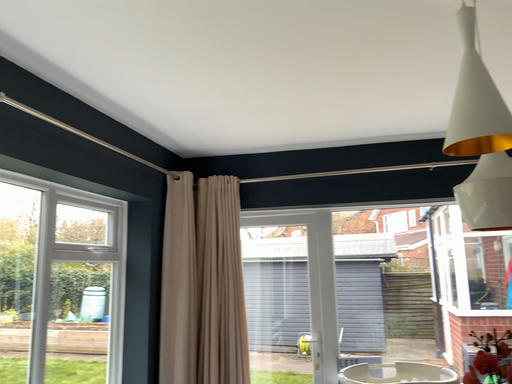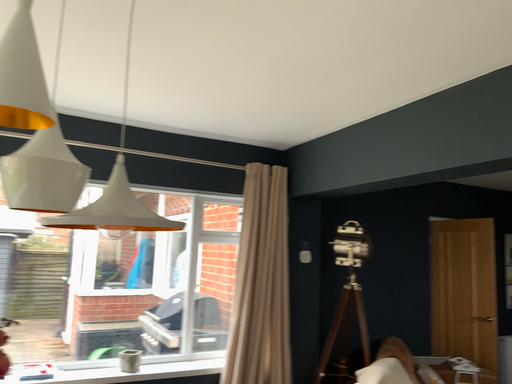
Question: Which way did the camera rotate in the video?

Choices:
 (A) rotated left
 (B) rotated right

Answer: (B)